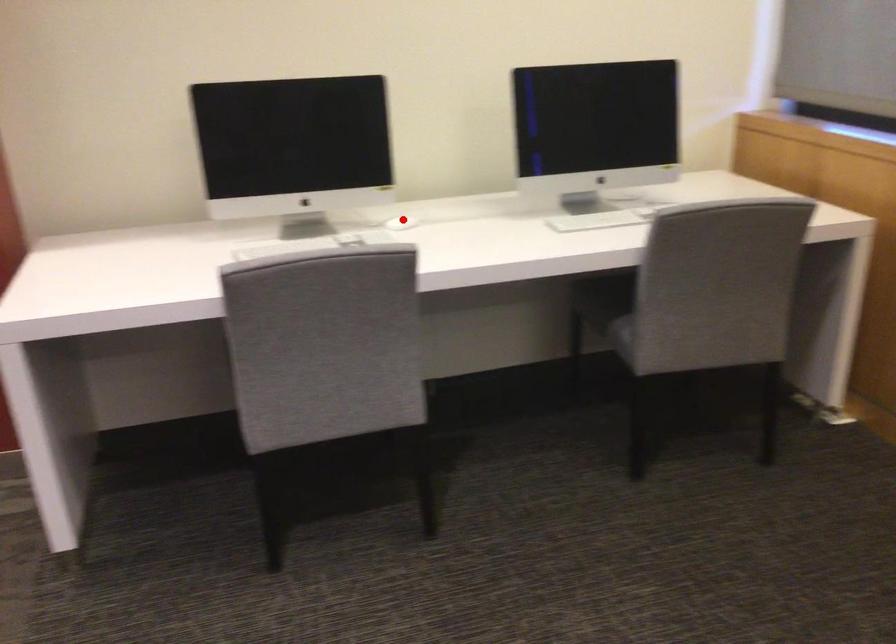
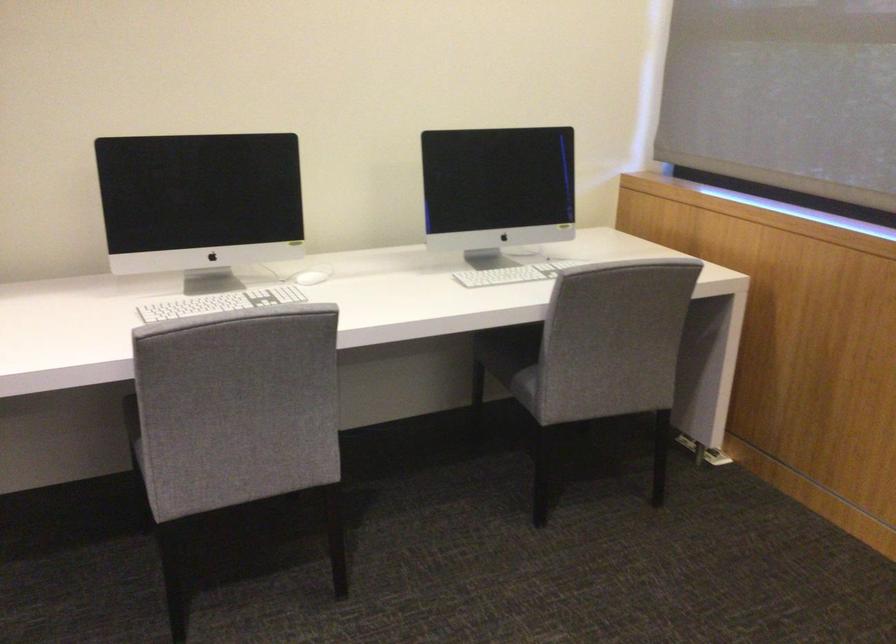
Where in the second image is the point corresponding to the highlighted location from the first image?

(307, 277)